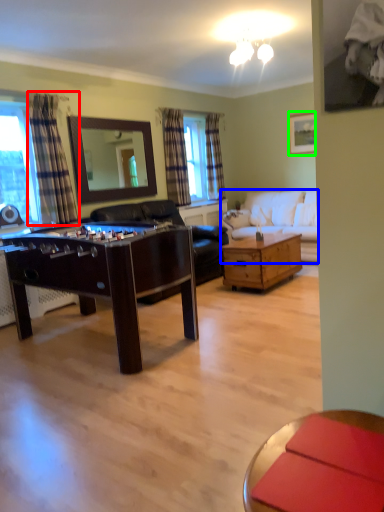
Question: Estimate the real-world distances between objects in this image. Which object is closer to curtain (highlighted by a red box), studio couch (highlighted by a blue box) or picture frame (highlighted by a green box)?

Choices:
 (A) studio couch
 (B) picture frame

Answer: (A)